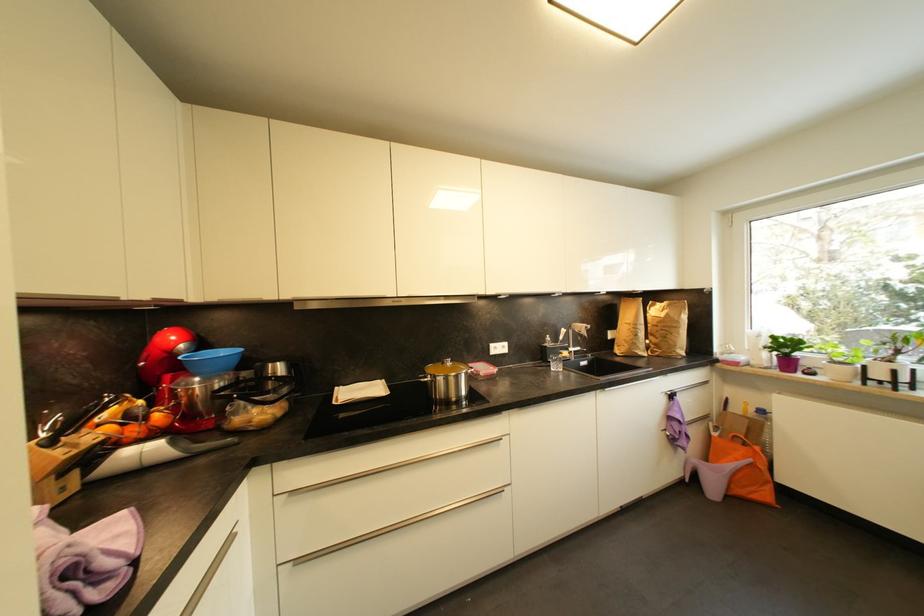
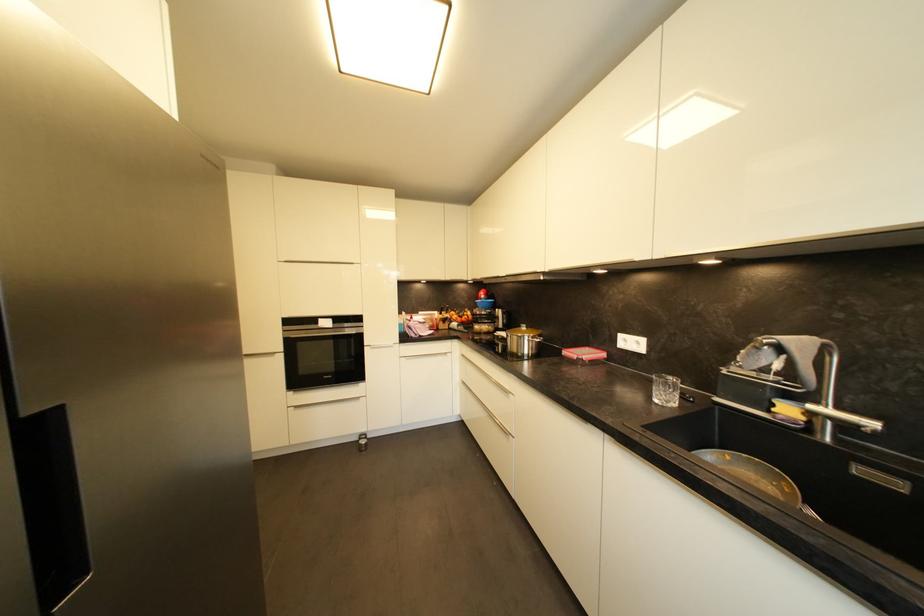
Where in the second image is the point corresponding to pixel 507 349 from the first image?

(642, 345)